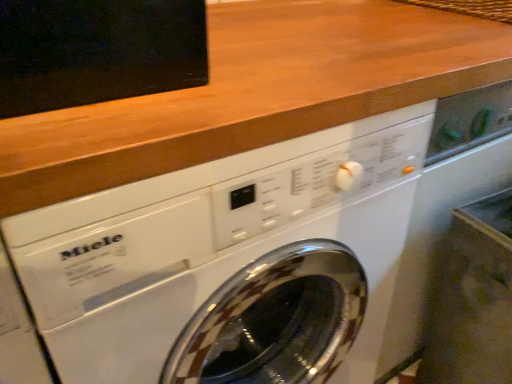
Question: From a real-world perspective, is wooden at upper center under white glossy washing machine at center?

Choices:
 (A) yes
 (B) no

Answer: (B)

Question: Is wooden at upper center aimed at white glossy washing machine at center?

Choices:
 (A) no
 (B) yes

Answer: (A)

Question: From the image's perspective, would you say wooden at upper center is positioned over white glossy washing machine at center?

Choices:
 (A) yes
 (B) no

Answer: (A)

Question: Is wooden at upper center thinner than white glossy washing machine at center?

Choices:
 (A) no
 (B) yes

Answer: (B)

Question: Does wooden at upper center have a smaller size compared to white glossy washing machine at center?

Choices:
 (A) yes
 (B) no

Answer: (A)

Question: Can you confirm if wooden at upper center is positioned to the right of white glossy washing machine at center?

Choices:
 (A) yes
 (B) no

Answer: (A)

Question: Is white glossy washing machine at center with wooden at upper center?

Choices:
 (A) no
 (B) yes

Answer: (A)

Question: Does white glossy washing machine at center have a greater width compared to wooden at upper center?

Choices:
 (A) no
 (B) yes

Answer: (B)

Question: Can you confirm if white glossy washing machine at center is bigger than wooden at upper center?

Choices:
 (A) no
 (B) yes

Answer: (B)

Question: Considering the relative sizes of white glossy washing machine at center and wooden at upper center in the image provided, is white glossy washing machine at center thinner than wooden at upper center?

Choices:
 (A) yes
 (B) no

Answer: (B)

Question: Would you consider white glossy washing machine at center to be distant from wooden at upper center?

Choices:
 (A) no
 (B) yes

Answer: (A)

Question: Can you confirm if white glossy washing machine at center is shorter than wooden at upper center?

Choices:
 (A) yes
 (B) no

Answer: (B)

Question: Is white glossy washing machine at center wider or thinner than wooden at upper center?

Choices:
 (A) wide
 (B) thin

Answer: (A)